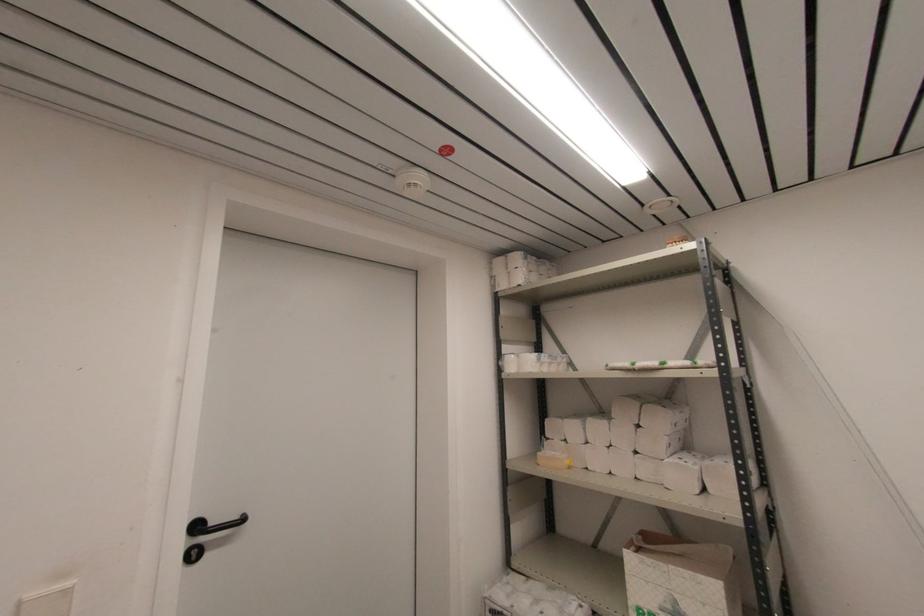
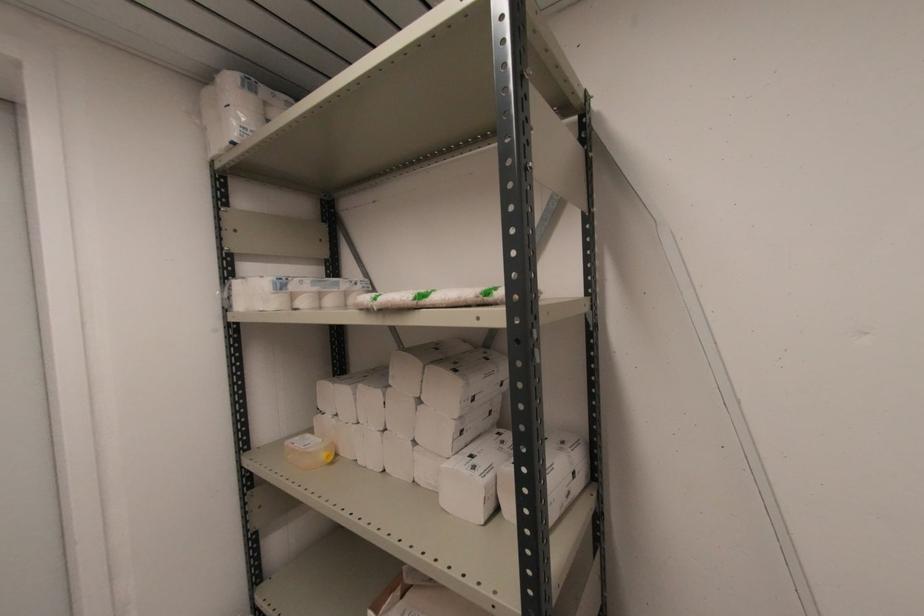
In a continuous first-person perspective shot, in which direction is the camera moving?

The cameraman walked toward right, forward.